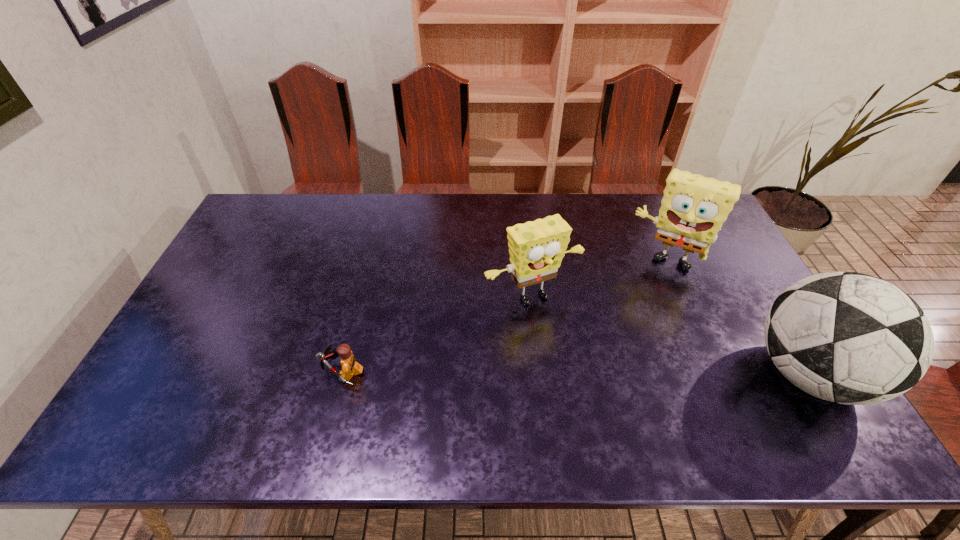
Identify the location of free space on the desktop that is between the shortest object and the soccer ball and is positioned on the front-facing side of the shorter sponge. click(x=583, y=373).

At what (x,y) coordinates should I click in order to perform the action: click on free space on the desktop that is between the leftmost object and the soccer ball and is positioned on the face of the farther sponge. Please return your answer as a coordinate pair (x, y). The height and width of the screenshot is (540, 960). Looking at the image, I should click on (619, 373).